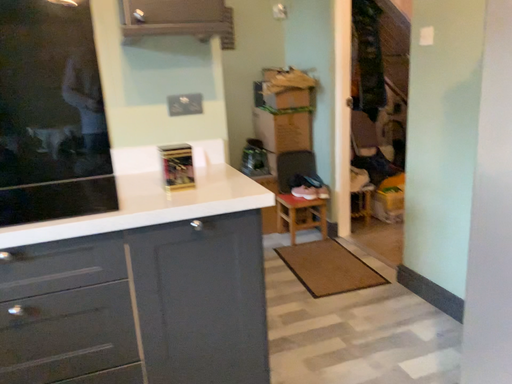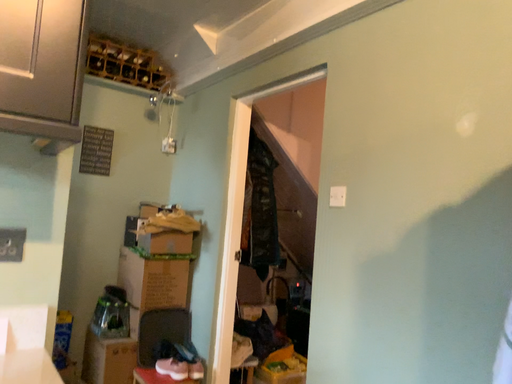
Question: Which way did the camera rotate in the video?

Choices:
 (A) rotated downward
 (B) rotated upward

Answer: (B)